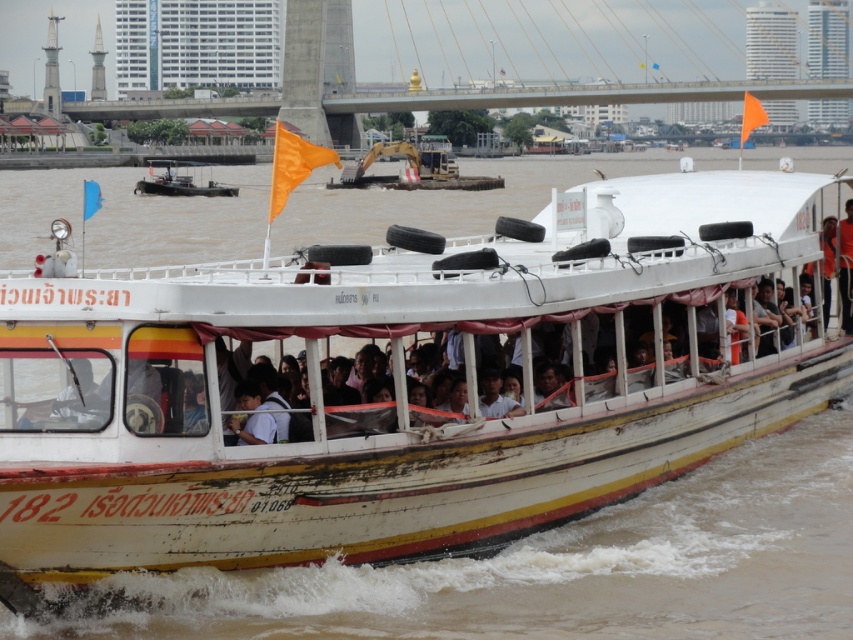
You are a photographer standing on the riverbank and want to capture both the white passenger boat with the number 182 and the orange flags. You notice two points marked on your map at coordinates point (674, 566) and point (196, 186). Which point should you choose to ensure the white passenger boat with the number 182 is in focus while still including the orange flags in the background?

You should choose point (674, 566) because it is closer to the camera than point (196, 186). This will allow the white passenger boat with the number 182 to be in focus while the orange flags remain visible in the background.

You are a passenger on the metallic gray boat at center and want to wave to the orange fabric person at center. Can you see them clearly from your current position?

The metallic gray boat at center is further to the viewer than orange fabric person at center, so you can see them clearly.

You are a passenger on the white wooden boat at center and want to see the orange fabric person at center. Which direction should you look to see them?

The white wooden boat at center is in front of orange fabric person at center, so you should look behind you to see them.